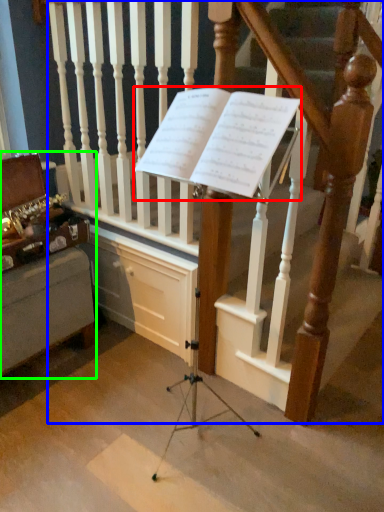
Question: Which is nearer to the sheet music (highlighted by a red box)? stairs (highlighted by a blue box) or furniture (highlighted by a green box).

Choices:
 (A) stairs
 (B) furniture

Answer: (A)